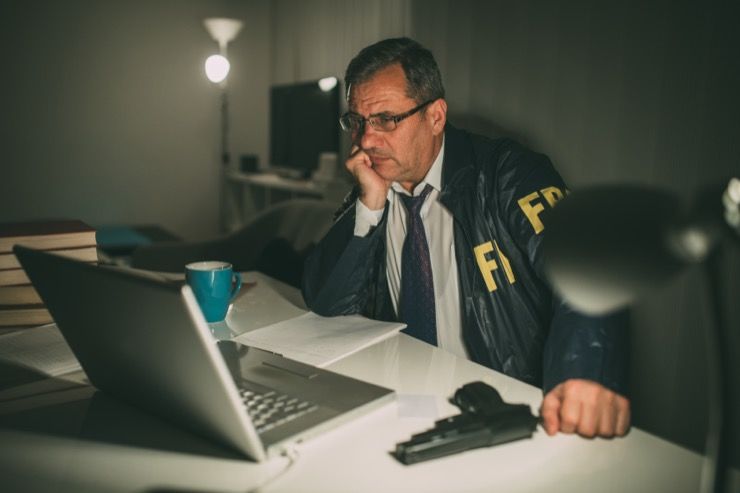
Identify the location of clicker button laptop. The height and width of the screenshot is (493, 740). click(x=289, y=368).